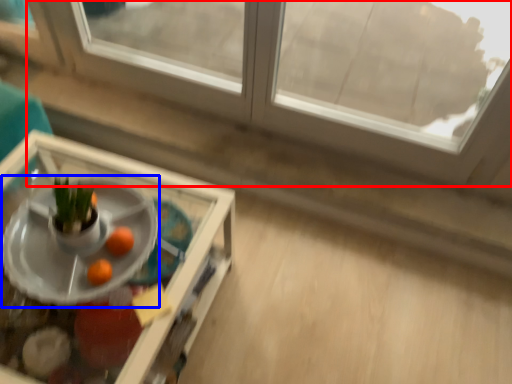
Question: Which point is closer to the camera, window (highlighted by a red box) or table (highlighted by a blue box)?

Choices:
 (A) window
 (B) table

Answer: (B)